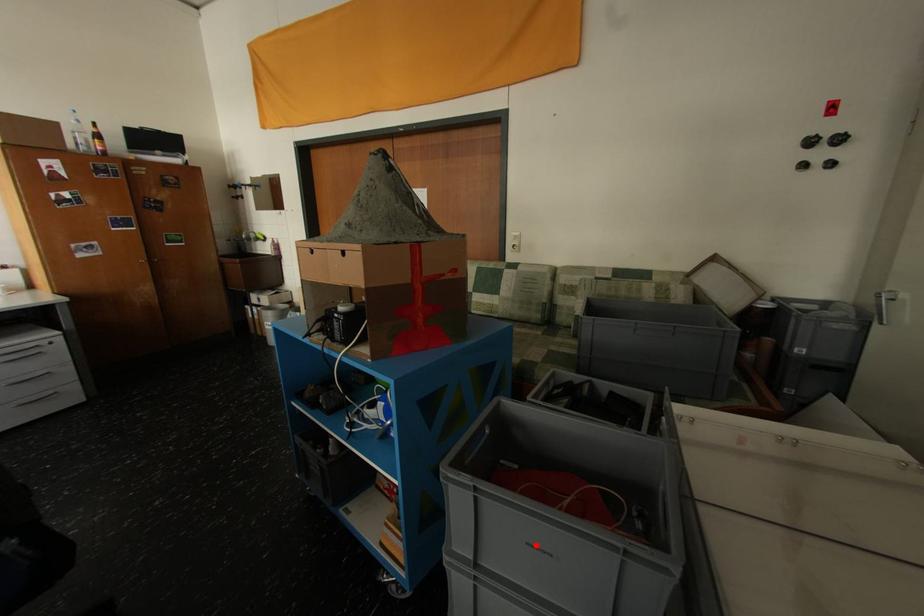
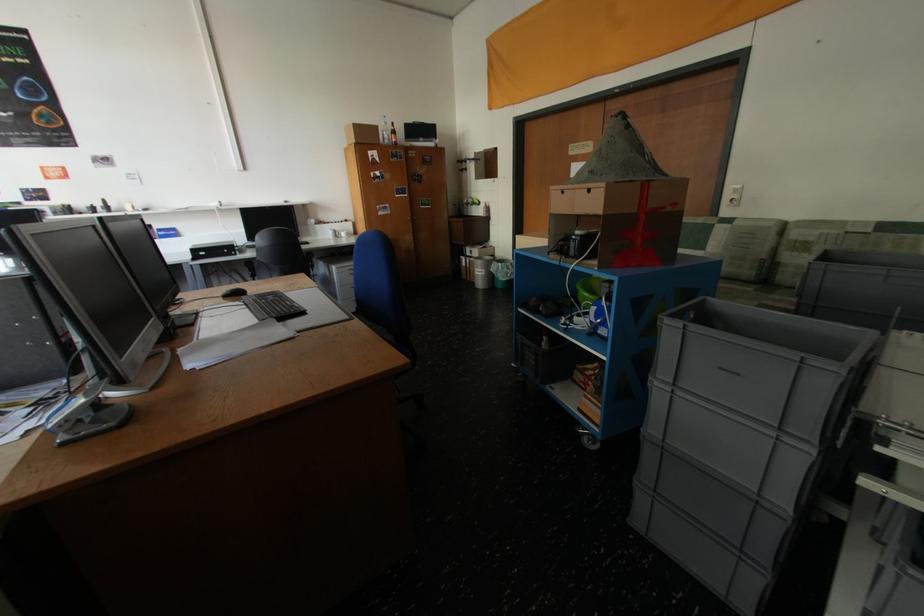
In the second image, find the point that corresponds to the highlighted location in the first image.

(728, 370)